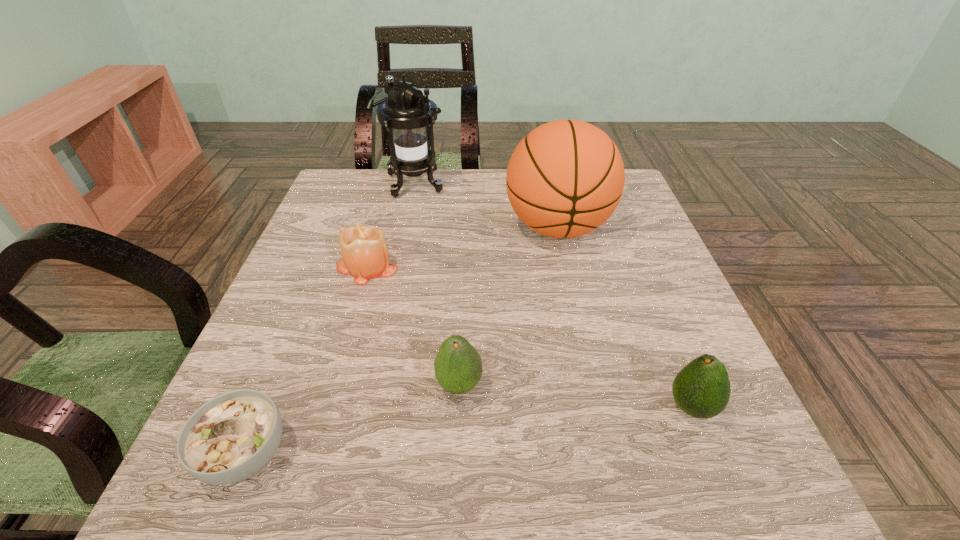
At what (x,y) coordinates should I click in order to perform the action: click on free space located 0.320m on the back of the right avocado. Please return your answer as a coordinate pair (x, y). Looking at the image, I should click on (634, 264).

Identify the location of vacant space located 0.260m on the right of the shortest object. (466, 454).

Where is `lantern at the far edge`? This screenshot has height=540, width=960. lantern at the far edge is located at coordinates (408, 112).

Locate an element on the screen. This screenshot has width=960, height=540. basketball positioned at the far edge is located at coordinates (565, 178).

Where is `object located at the near edge`? This screenshot has height=540, width=960. object located at the near edge is located at coordinates (231, 437).

At what (x,y) coordinates should I click in order to perform the action: click on lantern that is at the left edge. Please return your answer as a coordinate pair (x, y). The image size is (960, 540). Looking at the image, I should click on (408, 112).

At what (x,y) coordinates should I click in order to perform the action: click on candle positioned at the left edge. Please return your answer as a coordinate pair (x, y). Looking at the image, I should click on (364, 250).

I want to click on soup bowl that is at the left edge, so click(x=231, y=437).

What are the coordinates of `basketball located in the right edge section of the desktop` in the screenshot? It's located at (565, 178).

Find the location of a particular element. This screenshot has height=540, width=960. avocado situated at the right edge is located at coordinates (701, 389).